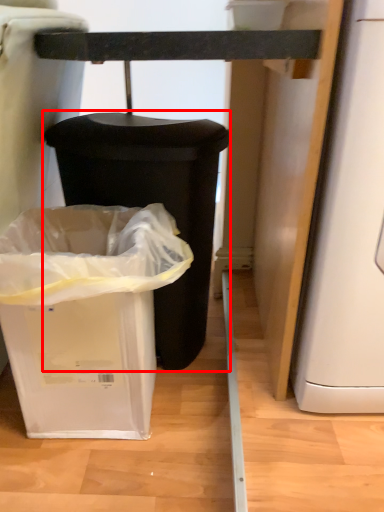
Question: From the image's perspective, what is the correct spatial positioning of waste container (annotated by the red box) in reference to waste container?

Choices:
 (A) below
 (B) above

Answer: (B)